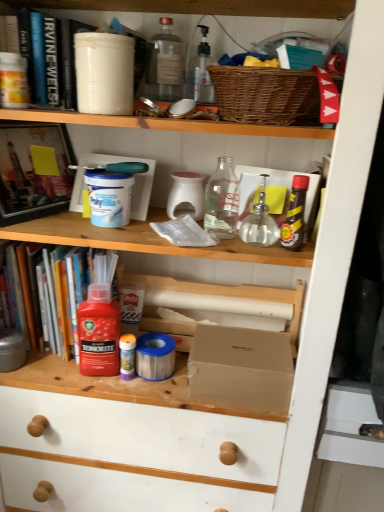
You are a GUI agent. You are given a task and a screenshot of the screen. Output one action in this format:
    pyautogui.click(x=<x>, y=<y>)
    Task: Click on the woven brown basket at upper center
    The image size is (384, 512).
    Given the screenshot: What is the action you would take?
    pyautogui.click(x=266, y=95)

This screenshot has height=512, width=384. What are the coordinates of `translucent plastic bottle at center, acting as the second bottle starting from the left` in the screenshot? It's located at (127, 356).

This screenshot has height=512, width=384. What are the coordinates of `red matte plastic bottle at left, which appears as the 4th bottle when viewed from the top` in the screenshot? It's located at (99, 332).

What are the coordinates of `hardcover book at upper left, which is the second book from bottom to top` in the screenshot? It's located at (34, 170).

Identify the location of matte cardboard box at center. Image resolution: width=384 pixels, height=512 pixels. [x=241, y=367].

At what (x,y) coordinates should I click in order to perform the action: click on red plastic bottle at left, placed as the 1th book when sorted from bottom to top. Please return your answer as a coordinate pair (x, y). The image size is (384, 512). Looking at the image, I should click on (53, 293).

Describe the element at coordinates (53, 293) in the screenshot. I see `red plastic bottle at left, marked as the 3th book in a top-to-bottom arrangement` at that location.

Find the location of a particular element. This screenshot has width=384, height=512. woven brown basket at upper center is located at coordinates (266, 95).

The width and height of the screenshot is (384, 512). In order to click on the 3rd bottle positioned above the matte cardboard box at center (from a real-world perspective) in this screenshot , I will do `click(259, 223)`.

Considering the positions of objects transparent glass bottle at center, the fourth bottle ordered from the bottom, and matte cardboard box at center in the image provided, who is more to the left, transparent glass bottle at center, the fourth bottle ordered from the bottom, or matte cardboard box at center?

matte cardboard box at center.

Is matte cardboard box at center located within transparent glass bottle at center, acting as the 2th bottle starting from the top?

No, transparent glass bottle at center, acting as the 2th bottle starting from the top, does not contain matte cardboard box at center.

Is the position of transparent glass bottle at center, acting as the 2th bottle starting from the top, more distant than that of matte cardboard box at center?

No, transparent glass bottle at center, acting as the 2th bottle starting from the top, is in front of matte cardboard box at center.

Does hardcover book at upper left, which is the second book from bottom to top, touch shiny brown bottle at upper right, the 3th bottle viewed from the top?

No, hardcover book at upper left, which is the second book from bottom to top, is not next to shiny brown bottle at upper right, the 3th bottle viewed from the top.

From the image's perspective, which object appears higher, hardcover book at upper left, which is the second book from bottom to top, or shiny brown bottle at upper right, the 3th bottle viewed from the top?

hardcover book at upper left, which is the second book from bottom to top, appears higher in the image.

Which is more to the right, hardcover book at upper left, the second book when ordered from top to bottom, or shiny brown bottle at upper right, marked as the third bottle in a bottom-to-top arrangement?

shiny brown bottle at upper right, marked as the third bottle in a bottom-to-top arrangement, is more to the right.

Is hardcover book at upper left, which is the second book from bottom to top, behind shiny brown bottle at upper right, marked as the third bottle in a bottom-to-top arrangement?

Yes, the depth of hardcover book at upper left, which is the second book from bottom to top, is greater than that of shiny brown bottle at upper right, marked as the third bottle in a bottom-to-top arrangement.

From a real-world perspective, is shiny brown bottle at upper right, which is the first bottle from right to left, above or below woven brown basket at upper center?

From a real-world perspective, shiny brown bottle at upper right, which is the first bottle from right to left, is physically below woven brown basket at upper center.

Image resolution: width=384 pixels, height=512 pixels. In order to click on bottle on the right of woven brown basket at upper center in this screenshot , I will do `click(295, 215)`.

Can you confirm if hardcover book at upper left, the second book when ordered from top to bottom, is shorter than transparent glass bottle at center, acting as the 2th bottle starting from the top?

Incorrect, the height of hardcover book at upper left, the second book when ordered from top to bottom, does not fall short of that of transparent glass bottle at center, acting as the 2th bottle starting from the top.

Which book is the 1st one when counting from the back of the transparent glass bottle at center, arranged as the fourth bottle when viewed from the left? Please provide its 2D coordinates.

[(34, 170)]

Is hardcover book at upper left, which is the second book from bottom to top, spatially inside transparent glass bottle at center, arranged as the fourth bottle when viewed from the left, or outside of it?

hardcover book at upper left, which is the second book from bottom to top, is not inside transparent glass bottle at center, arranged as the fourth bottle when viewed from the left, it's outside.

Would you consider translucent plastic bottle at center, positioned as the fourth bottle in right-to-left order, to be distant from red matte plastic bottle at left, the first bottle in the left-to-right sequence?

No, translucent plastic bottle at center, positioned as the fourth bottle in right-to-left order, is not far from red matte plastic bottle at left, the first bottle in the left-to-right sequence.

Does translucent plastic bottle at center, which is the fifth bottle from top to bottom, have a smaller size compared to red matte plastic bottle at left, the second bottle in the bottom-to-top sequence?

Correct, translucent plastic bottle at center, which is the fifth bottle from top to bottom, occupies less space than red matte plastic bottle at left, the second bottle in the bottom-to-top sequence.

From a real-world perspective, who is located higher, translucent plastic bottle at center, which is the fifth bottle from top to bottom, or red matte plastic bottle at left, the second bottle in the bottom-to-top sequence?

red matte plastic bottle at left, the second bottle in the bottom-to-top sequence.

Image resolution: width=384 pixels, height=512 pixels. What are the coordinates of `bottle that is the 1st object located above the translucent plastic bottle at center, which appears as the 1th bottle when ordered from the bottom (from the image's perspective)` in the screenshot? It's located at (99, 332).

Looking at their sizes, would you say woven brown basket at upper center is wider or thinner than transparent glass bottle at center, arranged as the fourth bottle when viewed from the left?

Considering their sizes, woven brown basket at upper center looks broader than transparent glass bottle at center, arranged as the fourth bottle when viewed from the left.

From a real-world perspective, who is located lower, woven brown basket at upper center or transparent glass bottle at center, acting as the 2th bottle starting from the top?

transparent glass bottle at center, acting as the 2th bottle starting from the top.

I want to click on basket in front of the transparent glass bottle at center, acting as the 2th bottle starting from the top, so click(x=266, y=95).

Does woven brown basket at upper center appear on the right side of transparent glass bottle at center, acting as the 2th bottle starting from the top?

Correct, you'll find woven brown basket at upper center to the right of transparent glass bottle at center, acting as the 2th bottle starting from the top.

Does matte cardboard box at center appear on the left side of hardcover book at upper left, placed as the third book when sorted from bottom to top?

No, matte cardboard box at center is not to the left of hardcover book at upper left, placed as the third book when sorted from bottom to top.

Is hardcover book at upper left, the 1th book viewed from the top, a part of matte cardboard box at center?

No.

How many degrees apart are the facing directions of matte cardboard box at center and hardcover book at upper left, the 1th book viewed from the top?

The angle between the facing direction of matte cardboard box at center and the facing direction of hardcover book at upper left, the 1th book viewed from the top, is 0.0323 degrees.

Considering the sizes of objects matte cardboard box at center and hardcover book at upper left, the 1th book viewed from the top, in the image provided, who is wider, matte cardboard box at center or hardcover book at upper left, the 1th book viewed from the top,?

With larger width is matte cardboard box at center.

What are the coordinates of `cardboard box below the transparent glass bottle at center, which appears as the 2th bottle when viewed from the right (from a real-world perspective)` in the screenshot? It's located at (241, 367).

From the shiny brown bottle at upper right, the fifth bottle viewed from the left, count the 3rd book to the left and point to it. Please provide its 2D coordinates.

[(34, 170)]

From the image, which object appears to be farther from hardcover book at upper left, the second book when ordered from top to bottom, woven brown basket at upper center or shiny brown bottle at upper right, marked as the third bottle in a bottom-to-top arrangement?

Based on the image, shiny brown bottle at upper right, marked as the third bottle in a bottom-to-top arrangement, appears to be further to hardcover book at upper left, the second book when ordered from top to bottom.

Based on their spatial positions, is transparent glass bottle at center, which appears as the 2th bottle when viewed from the right, or red matte plastic bottle at left, the first bottle in the left-to-right sequence, further from hardcover book at upper left, the 1th book viewed from the top?

Based on the image, transparent glass bottle at center, which appears as the 2th bottle when viewed from the right, appears to be further to hardcover book at upper left, the 1th book viewed from the top.

Based on their spatial positions, is transparent glass bottle at upper center, positioned as the 5th bottle in bottom-to-top order, or hardcover book at upper left, placed as the third book when sorted from bottom to top, closer to woven brown basket at upper center?

Based on the image, transparent glass bottle at upper center, positioned as the 5th bottle in bottom-to-top order, appears to be nearer to woven brown basket at upper center.

Based on their spatial positions, is transparent glass bottle at center, arranged as the fourth bottle when viewed from the left, or translucent plastic bottle at center, acting as the second bottle starting from the left, further from hardcover book at upper left, the second book when ordered from top to bottom?

transparent glass bottle at center, arranged as the fourth bottle when viewed from the left, lies further to hardcover book at upper left, the second book when ordered from top to bottom, than the other object.

Based on their spatial positions, is shiny brown bottle at upper right, which is the first bottle from right to left, or matte cardboard box at center further from hardcover book at upper left, which is the second book from bottom to top?

shiny brown bottle at upper right, which is the first bottle from right to left, is positioned further to the anchor hardcover book at upper left, which is the second book from bottom to top.

Considering their positions, is red plastic bottle at left, marked as the 3th book in a top-to-bottom arrangement, positioned closer to transparent glass bottle at center, the fourth bottle ordered from the bottom, than red matte plastic bottle at left, the first bottle in the left-to-right sequence?

red matte plastic bottle at left, the first bottle in the left-to-right sequence.

Considering their positions, is transparent glass bottle at center, the fourth bottle ordered from the bottom, positioned further to red matte plastic bottle at left, the fifth bottle in the right-to-left sequence, than translucent plastic bottle at center, positioned as the fourth bottle in right-to-left order?

transparent glass bottle at center, the fourth bottle ordered from the bottom, lies further to red matte plastic bottle at left, the fifth bottle in the right-to-left sequence, than the other object.

Looking at the image, which one is located closer to red plastic bottle at left, placed as the 1th book when sorted from bottom to top, transparent glass bottle at upper center, which appears as the 3th bottle when viewed from the right, or translucent plastic bottle at center, positioned as the fourth bottle in right-to-left order?

translucent plastic bottle at center, positioned as the fourth bottle in right-to-left order, lies closer to red plastic bottle at left, placed as the 1th book when sorted from bottom to top, than the other object.

I want to click on bottle between red plastic bottle at left, marked as the 3th book in a top-to-bottom arrangement, and translucent plastic bottle at center, positioned as the fourth bottle in right-to-left order, so click(99, 332).

This screenshot has height=512, width=384. I want to click on basket between transparent glass bottle at upper center, which appears as the 3th bottle when viewed from the right, and red matte plastic bottle at left, which appears as the 4th bottle when viewed from the top, from top to bottom, so click(266, 95).

Image resolution: width=384 pixels, height=512 pixels. What are the coordinates of `cardboard box situated between red matte plastic bottle at left, the fifth bottle in the right-to-left sequence, and transparent glass bottle at center, which appears as the 2th bottle when viewed from the right, from left to right` in the screenshot? It's located at (241, 367).

Image resolution: width=384 pixels, height=512 pixels. I want to click on book between hardcover book at upper left, the 1th book viewed from the top, and shiny brown bottle at upper right, the 3th bottle viewed from the top, so click(53, 293).